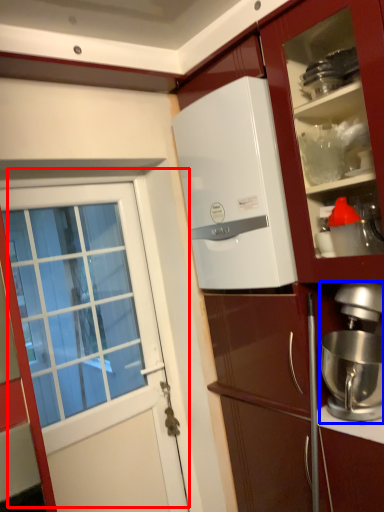
Question: Which object appears closest to the camera in this image, door (highlighted by a red box) or kitchen appliance (highlighted by a blue box)?

Choices:
 (A) door
 (B) kitchen appliance

Answer: (B)